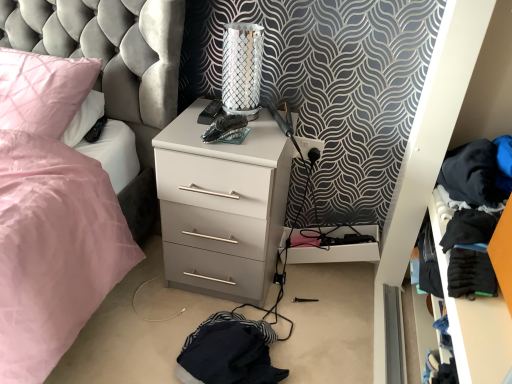
Question: Are white matte chest of drawers at center and pink satin pillow at upper left far apart?

Choices:
 (A) yes
 (B) no

Answer: (B)

Question: Is white matte chest of drawers at center located outside pink satin pillow at upper left?

Choices:
 (A) no
 (B) yes

Answer: (B)

Question: Can you confirm if white matte chest of drawers at center is smaller than pink satin pillow at upper left?

Choices:
 (A) yes
 (B) no

Answer: (B)

Question: Is white matte chest of drawers at center turned away from pink satin pillow at upper left?

Choices:
 (A) yes
 (B) no

Answer: (B)

Question: Is white matte chest of drawers at center shorter than pink satin pillow at upper left?

Choices:
 (A) no
 (B) yes

Answer: (A)

Question: Visually, is silver metallic table lamp at upper center positioned to the left or to the right of pink satin pillow at upper left?

Choices:
 (A) right
 (B) left

Answer: (A)

Question: Considering the positions of silver metallic table lamp at upper center and pink satin pillow at upper left in the image, is silver metallic table lamp at upper center bigger or smaller than pink satin pillow at upper left?

Choices:
 (A) big
 (B) small

Answer: (B)

Question: Is silver metallic table lamp at upper center inside or outside of pink satin pillow at upper left?

Choices:
 (A) inside
 (B) outside

Answer: (B)

Question: Is silver metallic table lamp at upper center taller or shorter than pink satin pillow at upper left?

Choices:
 (A) short
 (B) tall

Answer: (B)

Question: Is silver metallic table lamp at upper center spatially inside black fabric clothes at right, or outside of it?

Choices:
 (A) inside
 (B) outside

Answer: (B)

Question: Looking at the image, does silver metallic table lamp at upper center seem bigger or smaller compared to black fabric clothes at right?

Choices:
 (A) big
 (B) small

Answer: (B)

Question: Based on their positions, is silver metallic table lamp at upper center located to the left or right of black fabric clothes at right?

Choices:
 (A) right
 (B) left

Answer: (B)

Question: From the image's perspective, relative to black fabric clothes at right, is silver metallic table lamp at upper center above or below?

Choices:
 (A) above
 (B) below

Answer: (A)

Question: From the image's perspective, is black fabric clothes at right positioned above or below silver metallic table lamp at upper center?

Choices:
 (A) above
 (B) below

Answer: (B)

Question: From their relative heights in the image, would you say black fabric clothes at right is taller or shorter than silver metallic table lamp at upper center?

Choices:
 (A) tall
 (B) short

Answer: (A)